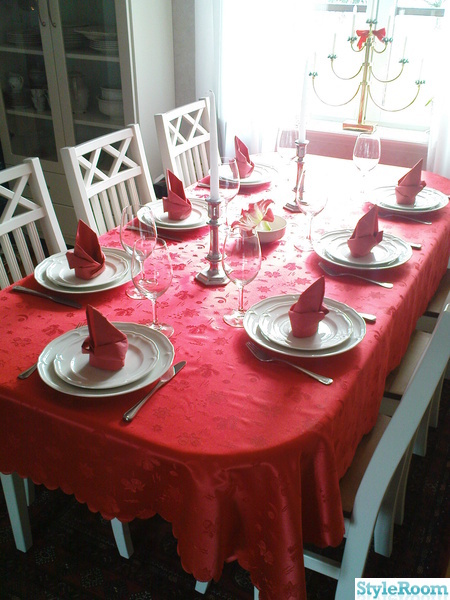
I want to click on 7 wine glasses, so click(x=153, y=300), click(x=139, y=225), click(x=244, y=260), click(x=229, y=176), click(x=319, y=198), click(x=284, y=147), click(x=376, y=149).